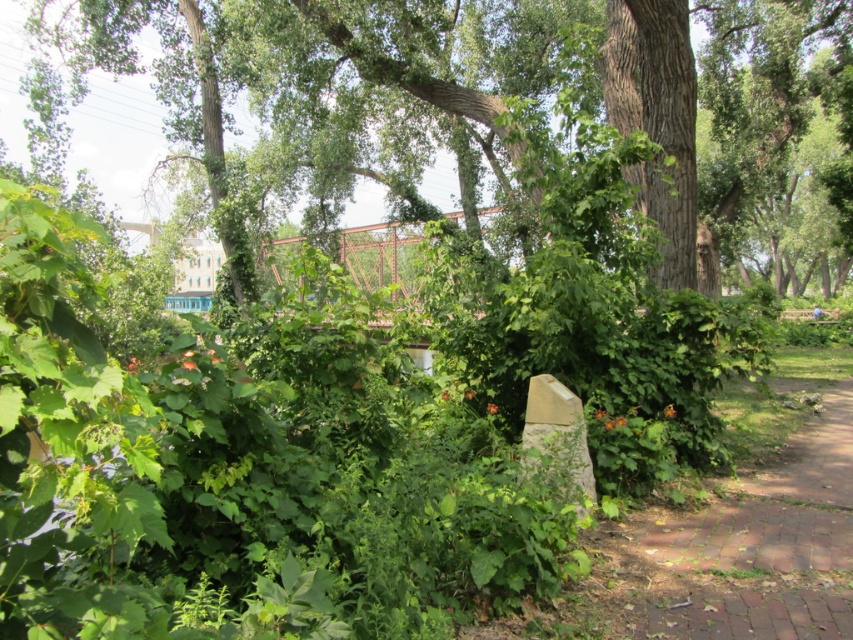
Which is behind, point (735, 493) or point (724, 275)?

The point (724, 275) is behind.

Is brick paved path at lower right bigger than green leafy tree at center?

No.

Is point (666, 605) more distant than point (758, 74)?

No, it is in front of (758, 74).

What are the coordinates of `brick paved path at lower right` in the screenshot? It's located at (751, 548).